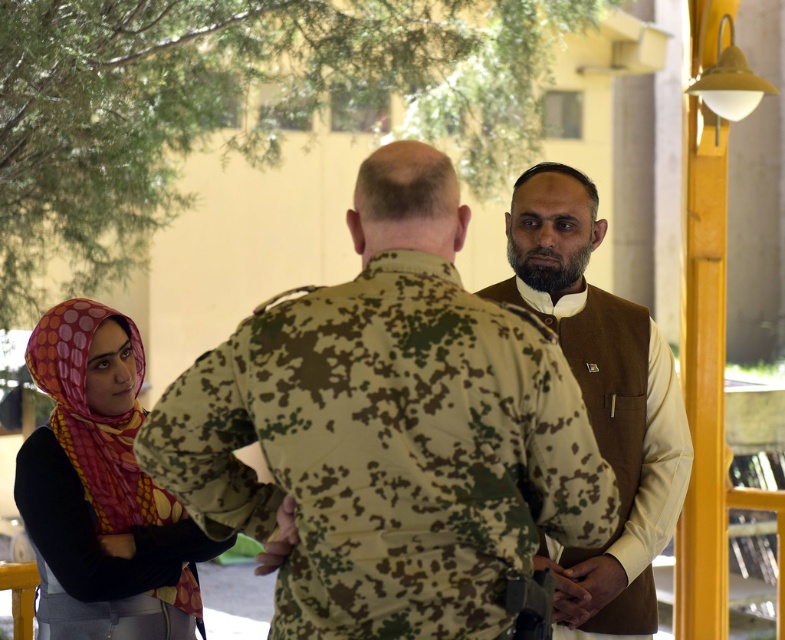
Based on the photo, can you confirm if polka dot fabric hijab at lower left is bigger than brown textured vest at center?

Indeed, polka dot fabric hijab at lower left has a larger size compared to brown textured vest at center.

Between polka dot fabric hijab at lower left and brown textured vest at center, which one has less height?

polka dot fabric hijab at lower left

Image resolution: width=785 pixels, height=640 pixels. Identify the location of polka dot fabric hijab at lower left. (101, 490).

Is camouflage uniform at center smaller than brown textured vest at center?

No, camouflage uniform at center is not smaller than brown textured vest at center.

Is point (506, 504) positioned before point (521, 177)?

Yes, it is.

At what (x,y) coordinates should I click in order to perform the action: click on camouflage uniform at center. Please return your answer as a coordinate pair (x, y). This screenshot has height=640, width=785. Looking at the image, I should click on [389, 429].

Is camouflage uniform at center below polka dot fabric hijab at lower left?

No.

Based on the photo, is the position of camouflage uniform at center more distant than that of polka dot fabric hijab at lower left?

No, camouflage uniform at center is closer to the viewer.

Is point (290, 561) more distant than point (132, 392)?

No, it is in front of (132, 392).

Locate an element on the screen. Image resolution: width=785 pixels, height=640 pixels. camouflage uniform at center is located at coordinates (389, 429).